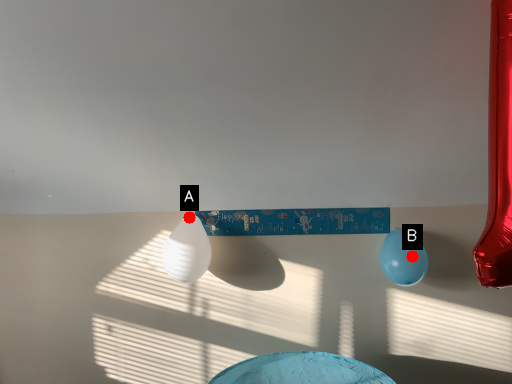
Question: Two points are circled on the image, labeled by A and B beside each circle. Which point is farther from the camera taking this photo?

Choices:
 (A) A is further
 (B) B is further

Answer: (A)